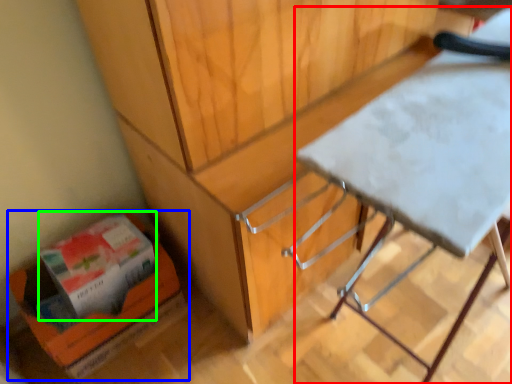
Question: Which object is positioned closest to table (highlighted by a red box)? Select from cardboard box (highlighted by a blue box) and box (highlighted by a green box).

Choices:
 (A) cardboard box
 (B) box

Answer: (A)